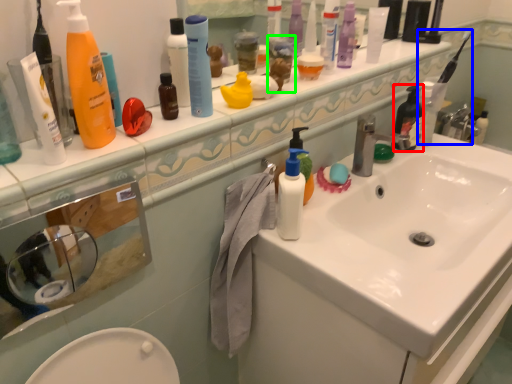
Question: Estimate the real-world distances between objects in this image. Which object is farther from toiletry (highlighted by a red box), toothbrush (highlighted by a blue box) or toiletry (highlighted by a green box)?

Choices:
 (A) toothbrush
 (B) toiletry

Answer: (B)